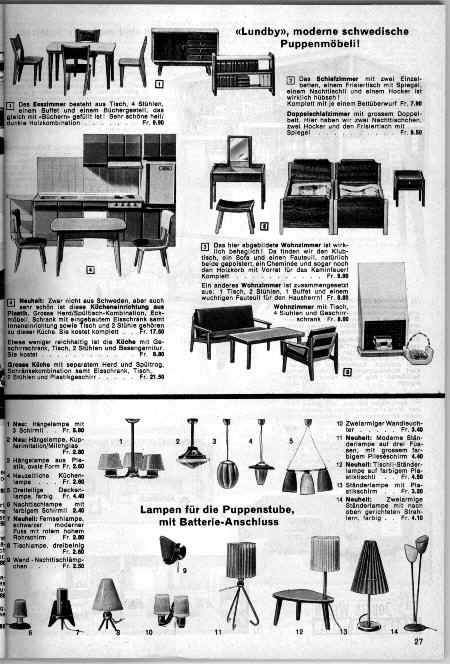
This screenshot has height=664, width=450. Find the location of `sink`. sink is located at coordinates (68, 196), (46, 196).